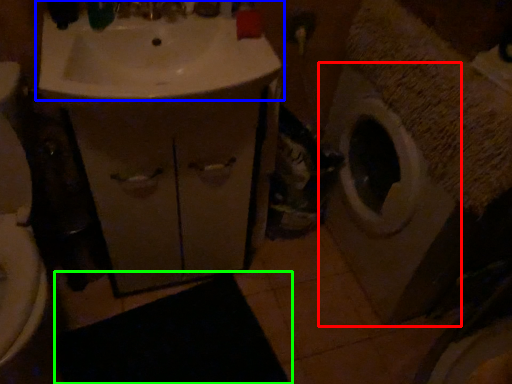
Question: Which object is the closest to the washing machine (highlighted by a red box)? Choose among these: sink (highlighted by a blue box) or bath mat (highlighted by a green box).

Choices:
 (A) sink
 (B) bath mat

Answer: (A)